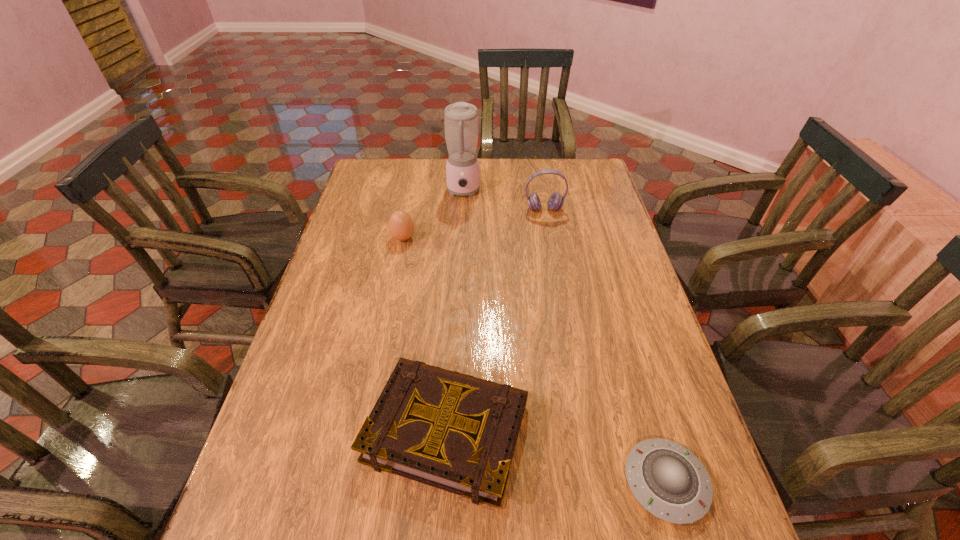
Locate an element on the screen. This screenshot has height=540, width=960. vacant space that's between the fourth tallest object and the shortest object is located at coordinates (556, 456).

Locate an element on the screen. The width and height of the screenshot is (960, 540). free space that is in between the shortest object and the boiled egg is located at coordinates (535, 360).

At what (x,y) coordinates should I click in order to perform the action: click on free point between the hardback book and the boiled egg. Please return your answer as a coordinate pair (x, y). Looking at the image, I should click on (425, 334).

This screenshot has height=540, width=960. Find the location of `free space between the boiled egg and the fourth nearest object`. free space between the boiled egg and the fourth nearest object is located at coordinates (473, 224).

Locate an element on the screen. This screenshot has height=540, width=960. vacant space that is in between the shortest object and the hardback book is located at coordinates (556, 456).

Locate an element on the screen. The width and height of the screenshot is (960, 540). free spot between the third tallest object and the farthest object is located at coordinates (433, 215).

Locate an element on the screen. free space between the third nearest object and the hardback book is located at coordinates click(x=425, y=334).

Image resolution: width=960 pixels, height=540 pixels. Identify the location of vacant area between the shortest object and the headset. (605, 346).

Locate an element on the screen. This screenshot has width=960, height=540. vacant point located between the second farthest object and the saucer is located at coordinates (605, 346).

This screenshot has height=540, width=960. I want to click on object that is the third closest to the shortest object, so click(401, 226).